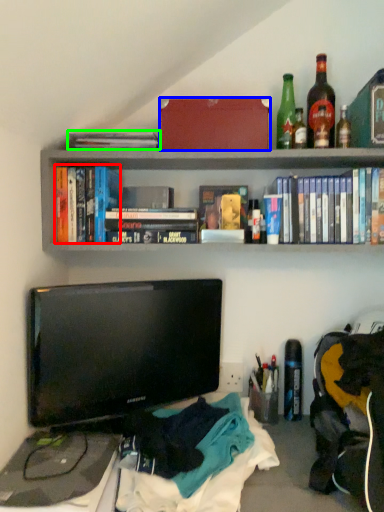
Question: Based on their relative distances, which object is nearer to book (highlighted by a red box)? Choose from box (highlighted by a blue box) and book (highlighted by a green box).

Choices:
 (A) box
 (B) book

Answer: (B)